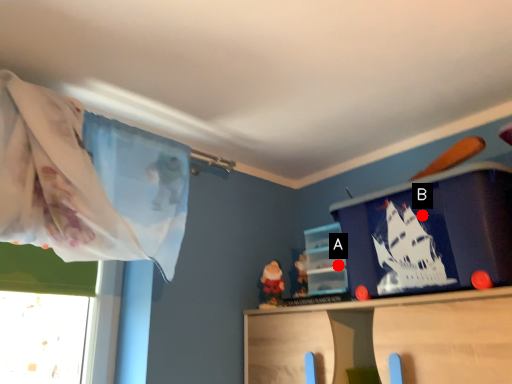
Question: Two points are circled on the image, labeled by A and B beside each circle. Which point is closer to the camera taking this photo?

Choices:
 (A) A is closer
 (B) B is closer

Answer: (B)